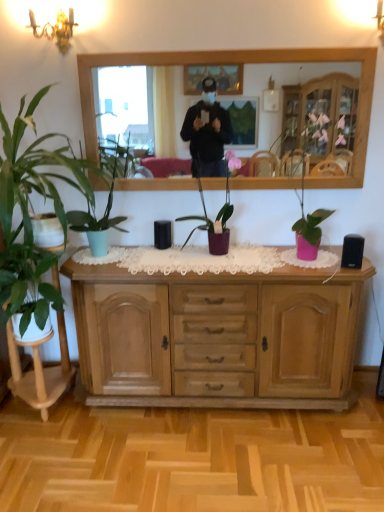
Question: Should I look upward or downward to see green glossy plant at left, which is counted as the first houseplant, starting from the left?

Choices:
 (A) up
 (B) down

Answer: (B)

Question: Is there a large distance between green glossy plant at left, which is counted as the first houseplant, starting from the left, and green matte plant at left, marked as the third houseplant in a right-to-left arrangement?

Choices:
 (A) no
 (B) yes

Answer: (A)

Question: Is green glossy plant at left, which is counted as the first houseplant, starting from the left, taller than green matte plant at left, marked as the third houseplant in a right-to-left arrangement?

Choices:
 (A) yes
 (B) no

Answer: (B)

Question: Considering the relative sizes of green glossy plant at left, which is the 4th houseplant from right to left, and green matte plant at left, the 2th houseplant positioned from the left, in the image provided, is green glossy plant at left, which is the 4th houseplant from right to left, bigger than green matte plant at left, the 2th houseplant positioned from the left,?

Choices:
 (A) no
 (B) yes

Answer: (A)

Question: Is green glossy plant at left, which is the 4th houseplant from right to left, to the left of green matte plant at left, marked as the third houseplant in a right-to-left arrangement, from the viewer's perspective?

Choices:
 (A) yes
 (B) no

Answer: (A)

Question: Is green glossy plant at left, which is counted as the first houseplant, starting from the left, shorter than green matte plant at left, the 2th houseplant positioned from the left?

Choices:
 (A) no
 (B) yes

Answer: (B)

Question: Does green glossy plant at left, which is counted as the first houseplant, starting from the left, appear on the right side of green matte plant at left, marked as the third houseplant in a right-to-left arrangement?

Choices:
 (A) yes
 (B) no

Answer: (B)

Question: Considering the relative sizes of purple matte plant at center, placed as the 1th houseplant when sorted from right to left, and wooden mirror at upper center in the image provided, is purple matte plant at center, placed as the 1th houseplant when sorted from right to left, wider than wooden mirror at upper center?

Choices:
 (A) yes
 (B) no

Answer: (A)

Question: From a real-world perspective, is purple matte plant at center, placed as the 1th houseplant when sorted from right to left, below wooden mirror at upper center?

Choices:
 (A) yes
 (B) no

Answer: (A)

Question: Is purple matte plant at center, placed as the 1th houseplant when sorted from right to left, not close to wooden mirror at upper center?

Choices:
 (A) no
 (B) yes

Answer: (B)

Question: Considering the relative positions of purple matte plant at center, placed as the 1th houseplant when sorted from right to left, and wooden mirror at upper center in the image provided, is purple matte plant at center, placed as the 1th houseplant when sorted from right to left, to the left of wooden mirror at upper center from the viewer's perspective?

Choices:
 (A) no
 (B) yes

Answer: (B)

Question: From the image's perspective, does purple matte plant at center, placed as the fourth houseplant when sorted from left to right, appear lower than wooden mirror at upper center?

Choices:
 (A) no
 (B) yes

Answer: (B)

Question: Considering the relative sizes of purple matte plant at center, placed as the fourth houseplant when sorted from left to right, and wooden mirror at upper center in the image provided, is purple matte plant at center, placed as the fourth houseplant when sorted from left to right, thinner than wooden mirror at upper center?

Choices:
 (A) yes
 (B) no

Answer: (B)

Question: From the image's perspective, does light brown wood cabinet at center appear higher than green matte plant at left, marked as the third houseplant in a right-to-left arrangement?

Choices:
 (A) no
 (B) yes

Answer: (A)